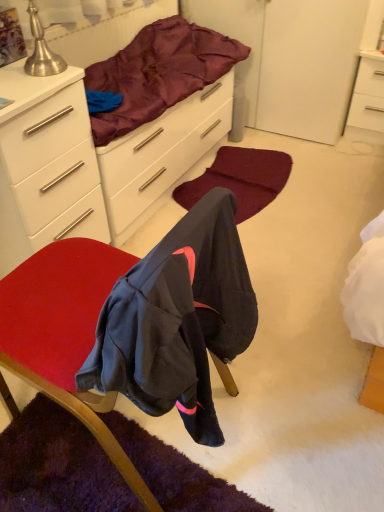
Question: From the image's perspective, does silky purple blanket at upper center appear lower than burgundy carpet at center?

Choices:
 (A) no
 (B) yes

Answer: (A)

Question: From a real-world perspective, is silky purple blanket at upper center physically below burgundy carpet at center?

Choices:
 (A) yes
 (B) no

Answer: (B)

Question: Is the depth of silky purple blanket at upper center less than that of burgundy carpet at center?

Choices:
 (A) yes
 (B) no

Answer: (A)

Question: Is silky purple blanket at upper center surrounding burgundy carpet at center?

Choices:
 (A) yes
 (B) no

Answer: (B)

Question: Is burgundy carpet at center at the back of silky purple blanket at upper center?

Choices:
 (A) no
 (B) yes

Answer: (A)

Question: Do you think silky purple blanket at upper center is within white matte cabinet at upper left, or outside of it?

Choices:
 (A) outside
 (B) inside

Answer: (A)

Question: Visually, is silky purple blanket at upper center positioned to the left or to the right of white matte cabinet at upper left?

Choices:
 (A) left
 (B) right

Answer: (B)

Question: Considering the positions of silky purple blanket at upper center and white matte cabinet at upper left in the image, is silky purple blanket at upper center wider or thinner than white matte cabinet at upper left?

Choices:
 (A) thin
 (B) wide

Answer: (A)

Question: From a real-world perspective, relative to white matte cabinet at upper left, is silky purple blanket at upper center vertically above or below?

Choices:
 (A) above
 (B) below

Answer: (A)

Question: From a real-world perspective, relative to white matte cabinet at upper left, is white glossy nightstand at upper right vertically above or below?

Choices:
 (A) above
 (B) below

Answer: (B)

Question: Based on their sizes in the image, would you say white glossy nightstand at upper right is bigger or smaller than white matte cabinet at upper left?

Choices:
 (A) big
 (B) small

Answer: (B)

Question: Does point (382, 57) appear closer or farther from the camera than point (44, 144)?

Choices:
 (A) closer
 (B) farther

Answer: (B)

Question: Based on their positions, is white glossy nightstand at upper right located to the left or right of white matte cabinet at upper left?

Choices:
 (A) right
 (B) left

Answer: (A)

Question: Considering their positions, is velvet-like red chair at center located in front of or behind white glossy nightstand at upper right?

Choices:
 (A) behind
 (B) front

Answer: (B)

Question: Based on their sizes in the image, would you say velvet-like red chair at center is bigger or smaller than white glossy nightstand at upper right?

Choices:
 (A) small
 (B) big

Answer: (B)